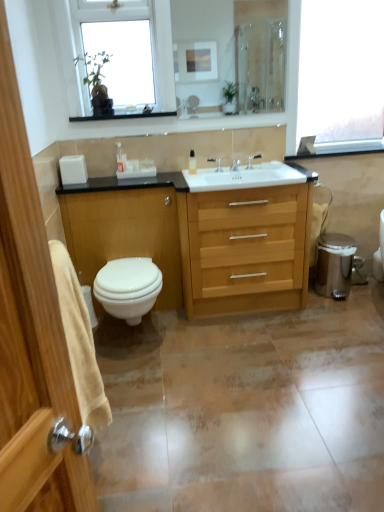
Based on the photo, measure the distance between point (x=168, y=20) and camera.

Point (x=168, y=20) is 2.53 meters from camera.

What is the approximate height of clear glass window at upper center, which is the second window from right to left?

26.11 inches.

What is the approximate height of white glossy soap dispenser at center, the third toiletry from the left?

white glossy soap dispenser at center, the third toiletry from the left, is 14.96 centimeters tall.

Measure the distance between white glossy toilet at left and camera.

They are 2.51 meters apart.

This screenshot has height=512, width=384. What do you see at coordinates (125, 234) in the screenshot? I see `white glossy toilet at left` at bounding box center [125, 234].

What do you see at coordinates (119, 158) in the screenshot?
I see `white glossy lotion at center, arranged as the 3th toiletry when viewed from the right` at bounding box center [119, 158].

Image resolution: width=384 pixels, height=512 pixels. Describe the element at coordinates (245, 410) in the screenshot. I see `matte brown tile at center` at that location.

This screenshot has height=512, width=384. Identify the location of clear glass window at upper center, which appears as the first window when viewed from the left. (146, 37).

From the picture: Considering the relative sizes of white matte toilet paper at right and white glossy lotion at center, which is the 2th toiletry in right-to-left order, in the image provided, is white matte toilet paper at right shorter than white glossy lotion at center, which is the 2th toiletry in right-to-left order,?

In fact, white matte toilet paper at right may be taller than white glossy lotion at center, which is the 2th toiletry in right-to-left order.

Does point (315, 252) lie in front of point (122, 155)?

No, it is behind (122, 155).

Is white matte toilet paper at right positioned with its back to white glossy lotion at center, which is the 2th toiletry in right-to-left order?

No, white matte toilet paper at right's orientation is not away from white glossy lotion at center, which is the 2th toiletry in right-to-left order.

Is the surface of white matte toilet paper at right in direct contact with white glossy lotion at center, which is the 2th toiletry in right-to-left order?

white matte toilet paper at right is not next to white glossy lotion at center, which is the 2th toiletry in right-to-left order, and they're not touching.

Considering the sizes of matte brown tile at center and clear glass window at upper center, which is the second window from right to left, in the image, is matte brown tile at center taller or shorter than clear glass window at upper center, which is the second window from right to left,?

Clearly, matte brown tile at center is shorter compared to clear glass window at upper center, which is the second window from right to left.

Could you tell me if matte brown tile at center is facing clear glass window at upper center, which is the second window from right to left?

No, matte brown tile at center is not turned towards clear glass window at upper center, which is the second window from right to left.

From a real-world perspective, is matte brown tile at center beneath clear glass window at upper center, which appears as the first window when viewed from the left?

Yes, from a real-world perspective, matte brown tile at center is under clear glass window at upper center, which appears as the first window when viewed from the left.

Does point (331, 65) come farther from viewer compared to point (234, 195)?

Yes, point (331, 65) is farther from viewer.

The height and width of the screenshot is (512, 384). What are the coordinates of `chest of drawers in front of the transparent glass window at upper right, which is counted as the 1th window, starting from the right` in the screenshot? It's located at (245, 248).

Is transparent glass window at upper right, the 2th window when ordered from left to right, outside of light wood/wooden chest of drawers at center?

Yes, transparent glass window at upper right, the 2th window when ordered from left to right, is not within light wood/wooden chest of drawers at center.

Is transparent glass window at upper right, the 2th window when ordered from left to right, facing towards light wood/wooden chest of drawers at center?

No, transparent glass window at upper right, the 2th window when ordered from left to right, is not facing towards light wood/wooden chest of drawers at center.

Is silver metallic faucet at center, the 1th tap when ordered from left to right, inside matte silver faucet at center, the first tap positioned from the right?

No, silver metallic faucet at center, the 1th tap when ordered from left to right, is not inside matte silver faucet at center, the first tap positioned from the right.

Looking at the image, does matte silver faucet at center, the second tap in the left-to-right sequence, seem bigger or smaller compared to silver metallic faucet at center, positioned as the 2th tap in right-to-left order?

In the image, matte silver faucet at center, the second tap in the left-to-right sequence, appears to be smaller than silver metallic faucet at center, positioned as the 2th tap in right-to-left order.

Consider the image. How distant is matte silver faucet at center, the first tap positioned from the right, from silver metallic faucet at center, positioned as the 2th tap in right-to-left order?

matte silver faucet at center, the first tap positioned from the right, and silver metallic faucet at center, positioned as the 2th tap in right-to-left order, are 8.38 inches apart from each other.

Which is more to the left, white glossy toilet at left or silver metallic faucet at center, the 1th tap when ordered from left to right?

white glossy toilet at left.

How different are the orientations of white glossy toilet at left and silver metallic faucet at center, the 1th tap when ordered from left to right, in degrees?

0.714 degrees separate the facing orientations of white glossy toilet at left and silver metallic faucet at center, the 1th tap when ordered from left to right.

Could you measure the distance between white glossy toilet at left and silver metallic faucet at center, positioned as the 2th tap in right-to-left order?

They are 29.05 inches apart.

In the scene shown: Is white glossy toilet at left turned away from silver metallic faucet at center, positioned as the 2th tap in right-to-left order?

No, white glossy toilet at left is not facing away from silver metallic faucet at center, positioned as the 2th tap in right-to-left order.

Looking at this image, from the image's perspective, between silver metallic faucet at center, the 1th tap when ordered from left to right, and white glossy lotion at center, which is the first toiletry from left to right, who is located below?

silver metallic faucet at center, the 1th tap when ordered from left to right, is shown below in the image.

Which is farther from the camera, (212, 160) or (122, 167)?

The point (212, 160) is more distant.

What's the angular difference between silver metallic faucet at center, the 1th tap when ordered from left to right, and white glossy lotion at center, which is the first toiletry from left to right,'s facing directions?

There is a 0.298-degree angle between the facing directions of silver metallic faucet at center, the 1th tap when ordered from left to right, and white glossy lotion at center, which is the first toiletry from left to right.

Does silver metallic faucet at center, the 1th tap when ordered from left to right, appear on the right side of white glossy lotion at center, which is the first toiletry from left to right?

Indeed, silver metallic faucet at center, the 1th tap when ordered from left to right, is positioned on the right side of white glossy lotion at center, which is the first toiletry from left to right.

Relative to white glossy soap dispenser at center, which is the first toiletry in right-to-left order, is white glossy toilet at lower left in front or behind?

white glossy toilet at lower left is positioned closer to the viewer than white glossy soap dispenser at center, which is the first toiletry in right-to-left order.

Can you confirm if white glossy toilet at lower left is wider than white glossy soap dispenser at center, the third toiletry from the left?

Indeed, white glossy toilet at lower left has a greater width compared to white glossy soap dispenser at center, the third toiletry from the left.

Is white glossy toilet at lower left taller or shorter than white glossy soap dispenser at center, the third toiletry from the left?

Clearly, white glossy toilet at lower left is taller compared to white glossy soap dispenser at center, the third toiletry from the left.

Is white glossy toilet at lower left positioned with its back to white glossy soap dispenser at center, the third toiletry from the left?

No, white glossy toilet at lower left is not facing away from white glossy soap dispenser at center, the third toiletry from the left.

You are a GUI agent. You are given a task and a screenshot of the screen. Output one action in this format:
    pyautogui.click(x=<x>, y=<y>)
    Task: Click on the 2nd toiletry above the white matte toilet paper at right (from a real-world perspective)
    This screenshot has height=512, width=384.
    Given the screenshot: What is the action you would take?
    pyautogui.click(x=124, y=161)

You are a GUI agent. You are given a task and a screenshot of the screen. Output one action in this format:
    pyautogui.click(x=<x>, y=<y>)
    Task: Click on the ceramic tile on the right side of clear glass window at upper center, which is the second window from right to left
    
    Given the screenshot: What is the action you would take?
    pyautogui.click(x=245, y=410)

Which object lies further to the anchor point clear glass window at upper center, which appears as the first window when viewed from the left, matte silver faucet at center, the first tap positioned from the right, or white glossy toilet at lower left?

white glossy toilet at lower left is positioned further to the anchor clear glass window at upper center, which appears as the first window when viewed from the left.

Based on their spatial positions, is white glossy toilet at lower left or white glossy toilet at left closer to clear glass window at upper center, which is the second window from right to left?

white glossy toilet at left is positioned closer to the anchor clear glass window at upper center, which is the second window from right to left.

Looking at the image, which one is located closer to white glossy toilet at left, transparent glass window at upper right, the 2th window when ordered from left to right, or white matte toilet paper at right?

white matte toilet paper at right is closer to white glossy toilet at left.

Considering their positions, is silver metallic faucet at center, positioned as the 2th tap in right-to-left order, positioned closer to white glossy soap dispenser at center, which is the first toiletry in right-to-left order, than matte brown tile at center?

The object closer to white glossy soap dispenser at center, which is the first toiletry in right-to-left order, is silver metallic faucet at center, positioned as the 2th tap in right-to-left order.

From the image, which object appears to be farther from silver metallic faucet at center, the 1th tap when ordered from left to right, white matte toilet paper at right or light wood/wooden chest of drawers at center?

The object further to silver metallic faucet at center, the 1th tap when ordered from left to right, is white matte toilet paper at right.

From the image, which object appears to be farther from light wood/wooden chest of drawers at center, clear glass window at upper center, which appears as the first window when viewed from the left, or matte silver faucet at center, the second tap in the left-to-right sequence?

Based on the image, clear glass window at upper center, which appears as the first window when viewed from the left, appears to be further to light wood/wooden chest of drawers at center.

When comparing their distances from clear glass window at upper center, which is the second window from right to left, does light wood/wooden chest of drawers at center or white glossy toilet at left seem closer?

The object closer to clear glass window at upper center, which is the second window from right to left, is white glossy toilet at left.

Looking at the image, which one is located further to white glossy soap dispenser at center, the third toiletry from the left, matte brown tile at center or light wood/wooden chest of drawers at center?

matte brown tile at center is further to white glossy soap dispenser at center, the third toiletry from the left.

Find the location of a particular element. Image resolution: width=384 pixels, height=512 pixels. tap between white glossy toilet at left and light wood/wooden chest of drawers at center in the horizontal direction is located at coordinates (216, 162).

This screenshot has width=384, height=512. I want to click on tap that lies between white glossy lotion at center, arranged as the 3th toiletry when viewed from the right, and white glossy toilet at lower left from top to bottom, so click(216, 162).

Where is `the chest of drawers positioned between matte brown tile at center and white glossy lotion at center, which is the first toiletry from left to right, from near to far`? the chest of drawers positioned between matte brown tile at center and white glossy lotion at center, which is the first toiletry from left to right, from near to far is located at coordinates pyautogui.click(x=245, y=248).

Where is `the chest of drawers that lies between silver metallic faucet at center, positioned as the 2th tap in right-to-left order, and white glossy toilet at lower left from top to bottom`? The image size is (384, 512). the chest of drawers that lies between silver metallic faucet at center, positioned as the 2th tap in right-to-left order, and white glossy toilet at lower left from top to bottom is located at coordinates (245, 248).